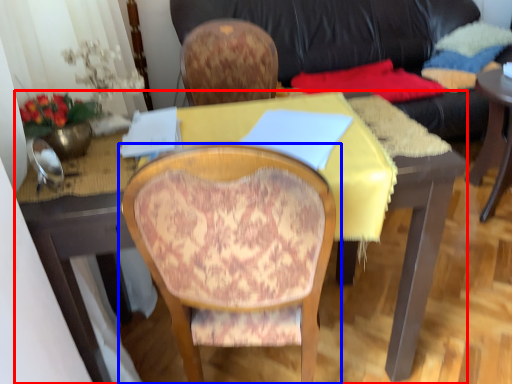
Question: Among these objects, which one is nearest to the camera, desk (highlighted by a red box) or chair (highlighted by a blue box)?

Choices:
 (A) desk
 (B) chair

Answer: (B)